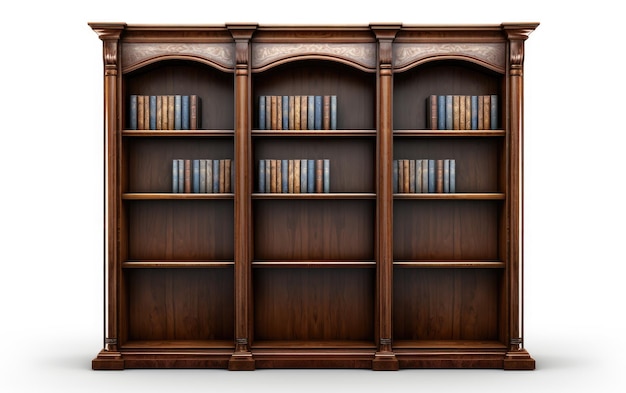
Identify the location of books on second shelf, left side. (170, 176), (178, 177), (185, 177), (193, 179), (201, 179), (206, 179), (213, 179), (220, 179), (226, 178), (230, 178).